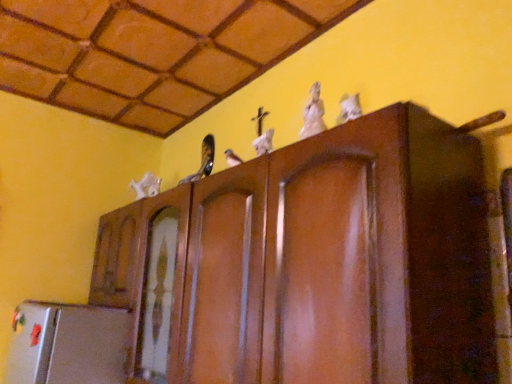
This screenshot has width=512, height=384. Describe the element at coordinates (349, 108) in the screenshot. I see `white glossy cat at upper right, acting as the third animal starting from the back` at that location.

Where is `white matte animal at left, which is the 1th animal in left-to-right order`? white matte animal at left, which is the 1th animal in left-to-right order is located at coordinates (146, 186).

Locate an element on the screen. The image size is (512, 384). white glossy statue at upper center, which appears as the second animal when viewed from the right is located at coordinates (313, 113).

Is white glossy cat at upper right, the 1th animal viewed from the front, inside the boundaries of white matte animal at left, which is the 1th animal in left-to-right order, or outside?

white glossy cat at upper right, the 1th animal viewed from the front, lies outside white matte animal at left, which is the 1th animal in left-to-right order.

From a real-world perspective, is white glossy cat at upper right, which is counted as the first animal, starting from the right, positioned over white matte animal at left, which is the 1th animal in left-to-right order, based on gravity?

No.

Is white glossy cat at upper right, which is counted as the first animal, starting from the right, facing towards white matte animal at left, which is counted as the first animal, starting from the back?

No, white glossy cat at upper right, which is counted as the first animal, starting from the right, is not oriented towards white matte animal at left, which is counted as the first animal, starting from the back.

Consider the image. Between white glossy cat at upper right, the third animal viewed from the left, and white matte animal at left, the third animal in the front-to-back sequence, which one has smaller size?

Smaller between the two is white glossy cat at upper right, the third animal viewed from the left.

Considering the sizes of white matte animal at left, placed as the third animal when sorted from right to left, and white glossy statue at upper center, which appears as the second animal when viewed from the right, in the image, is white matte animal at left, placed as the third animal when sorted from right to left, wider or thinner than white glossy statue at upper center, which appears as the second animal when viewed from the right,?

white matte animal at left, placed as the third animal when sorted from right to left, is wider than white glossy statue at upper center, which appears as the second animal when viewed from the right.

Is white matte animal at left, which is counted as the first animal, starting from the back, aimed at white glossy statue at upper center, placed as the 2th animal when sorted from front to back?

No.

Does white matte animal at left, the third animal in the front-to-back sequence, touch white glossy statue at upper center, which ranks as the 2th animal in back-to-front order?

No, white matte animal at left, the third animal in the front-to-back sequence, is not in contact with white glossy statue at upper center, which ranks as the 2th animal in back-to-front order.

Can you tell me how much white glossy statue at upper center, which appears as the second animal when viewed from the right, and white matte animal at left, the third animal in the front-to-back sequence, differ in facing direction?

0.00103 degrees.

Which object is positioned more to the right, white glossy statue at upper center, which ranks as the 2th animal in back-to-front order, or white matte animal at left, placed as the third animal when sorted from right to left?

From the viewer's perspective, white glossy statue at upper center, which ranks as the 2th animal in back-to-front order, appears more on the right side.

From the picture: Could you measure the distance between white glossy statue at upper center, placed as the 2th animal when sorted from front to back, and white matte animal at left, which is the 1th animal in left-to-right order?

white glossy statue at upper center, placed as the 2th animal when sorted from front to back, is 3.50 feet from white matte animal at left, which is the 1th animal in left-to-right order.

Is white glossy statue at upper center, which ranks as the 2th animal in back-to-front order, aimed at white matte animal at left, which is counted as the first animal, starting from the back?

No, white glossy statue at upper center, which ranks as the 2th animal in back-to-front order, does not turn towards white matte animal at left, which is counted as the first animal, starting from the back.

Could you tell me if white glossy statue at upper center, which ranks as the 2th animal in back-to-front order, is facing white glossy cat at upper right, acting as the third animal starting from the back?

No, white glossy statue at upper center, which ranks as the 2th animal in back-to-front order, is not aimed at white glossy cat at upper right, acting as the third animal starting from the back.

Considering the sizes of white glossy statue at upper center, which appears as the second animal when viewed from the right, and white glossy cat at upper right, which is counted as the first animal, starting from the right, in the image, is white glossy statue at upper center, which appears as the second animal when viewed from the right, wider or thinner than white glossy cat at upper right, which is counted as the first animal, starting from the right,?

Considering their sizes, white glossy statue at upper center, which appears as the second animal when viewed from the right, looks broader than white glossy cat at upper right, which is counted as the first animal, starting from the right.

How many degrees apart are the facing directions of white glossy statue at upper center, which ranks as the 2th animal in back-to-front order, and white glossy cat at upper right, which is counted as the first animal, starting from the right?

The facing directions of white glossy statue at upper center, which ranks as the 2th animal in back-to-front order, and white glossy cat at upper right, which is counted as the first animal, starting from the right, are 0.0058 degrees apart.

Which object is closer to the camera taking this photo, white glossy statue at upper center, placed as the 2th animal when sorted from front to back, or white glossy cat at upper right, the third animal viewed from the left?

white glossy cat at upper right, the third animal viewed from the left, is closer to the camera.

Would you say white matte animal at left, which is the 1th animal in left-to-right order, is to the left or to the right of white glossy cat at upper right, the third animal viewed from the left, in the picture?

Clearly, white matte animal at left, which is the 1th animal in left-to-right order, is on the left of white glossy cat at upper right, the third animal viewed from the left, in the image.

Considering the sizes of objects white matte animal at left, which is the 1th animal in left-to-right order, and white glossy cat at upper right, acting as the third animal starting from the back, in the image provided, who is smaller, white matte animal at left, which is the 1th animal in left-to-right order, or white glossy cat at upper right, acting as the third animal starting from the back,?

white glossy cat at upper right, acting as the third animal starting from the back.

Is white matte animal at left, the third animal in the front-to-back sequence, looking in the opposite direction of white glossy cat at upper right, the 1th animal viewed from the front?

That's not correct — white matte animal at left, the third animal in the front-to-back sequence, is not looking away from white glossy cat at upper right, the 1th animal viewed from the front.

Are white glossy cat at upper right, which is counted as the first animal, starting from the right, and white glossy statue at upper center, which appears as the second animal when viewed from the right, making contact?

Yes, white glossy cat at upper right, which is counted as the first animal, starting from the right, is next to white glossy statue at upper center, which appears as the second animal when viewed from the right.

From the picture: Would you say white glossy statue at upper center, placed as the 2th animal when sorted from front to back, is part of white glossy cat at upper right, the 1th animal viewed from the front,'s contents?

No, white glossy statue at upper center, placed as the 2th animal when sorted from front to back, is not surrounded by white glossy cat at upper right, the 1th animal viewed from the front.

Does point (357, 114) appear closer or farther from the camera than point (305, 106)?

Point (357, 114) appears to be closer to the viewer than point (305, 106).

Is white glossy statue at upper center, which ranks as the 2th animal in back-to-front order, at the back of white glossy cat at upper right, the 1th animal viewed from the front?

No, white glossy cat at upper right, the 1th animal viewed from the front, is not facing away from white glossy statue at upper center, which ranks as the 2th animal in back-to-front order.

Starting from the white glossy cat at upper right, acting as the third animal starting from the back, which animal is the 2nd one behind? Please provide its 2D coordinates.

[(146, 186)]

Locate an element on the screen. The width and height of the screenshot is (512, 384). the 1st animal to the right of the white matte animal at left, which is the 1th animal in left-to-right order, counting from the anchor's position is located at coordinates (313, 113).

When comparing their distances from white glossy cat at upper right, the third animal viewed from the left, does white glossy statue at upper center, which appears as the second animal when viewed from the right, or white matte animal at left, placed as the third animal when sorted from right to left, seem closer?

Based on the image, white glossy statue at upper center, which appears as the second animal when viewed from the right, appears to be nearer to white glossy cat at upper right, the third animal viewed from the left.

Looking at the image, which one is located closer to white matte animal at left, the third animal in the front-to-back sequence, white glossy statue at upper center, which ranks as the 2th animal in back-to-front order, or white glossy cat at upper right, the 1th animal viewed from the front?

white glossy statue at upper center, which ranks as the 2th animal in back-to-front order, lies closer to white matte animal at left, the third animal in the front-to-back sequence, than the other object.

When comparing their distances from white glossy statue at upper center, the second animal in the left-to-right sequence, does white matte animal at left, which is counted as the first animal, starting from the back, or white glossy cat at upper right, the third animal viewed from the left, seem further?

white matte animal at left, which is counted as the first animal, starting from the back, lies further to white glossy statue at upper center, the second animal in the left-to-right sequence, than the other object.

When comparing their distances from white matte animal at left, the third animal in the front-to-back sequence, does white glossy cat at upper right, acting as the third animal starting from the back, or white glossy statue at upper center, placed as the 2th animal when sorted from front to back, seem further?

The object further to white matte animal at left, the third animal in the front-to-back sequence, is white glossy cat at upper right, acting as the third animal starting from the back.

Looking at the image, which one is located closer to white glossy cat at upper right, the 1th animal viewed from the front, white matte animal at left, which is the 1th animal in left-to-right order, or white glossy statue at upper center, which ranks as the 2th animal in back-to-front order?

Based on the image, white glossy statue at upper center, which ranks as the 2th animal in back-to-front order, appears to be nearer to white glossy cat at upper right, the 1th animal viewed from the front.

From the image, which object appears to be farther from white glossy statue at upper center, placed as the 2th animal when sorted from front to back, white glossy cat at upper right, which is counted as the first animal, starting from the right, or white matte animal at left, which is counted as the first animal, starting from the back?

Based on the image, white matte animal at left, which is counted as the first animal, starting from the back, appears to be further to white glossy statue at upper center, placed as the 2th animal when sorted from front to back.

Where is `animal between white glossy cat at upper right, the third animal viewed from the left, and white matte animal at left, which is counted as the first animal, starting from the back, in the front-back direction`? This screenshot has width=512, height=384. animal between white glossy cat at upper right, the third animal viewed from the left, and white matte animal at left, which is counted as the first animal, starting from the back, in the front-back direction is located at coordinates (313, 113).